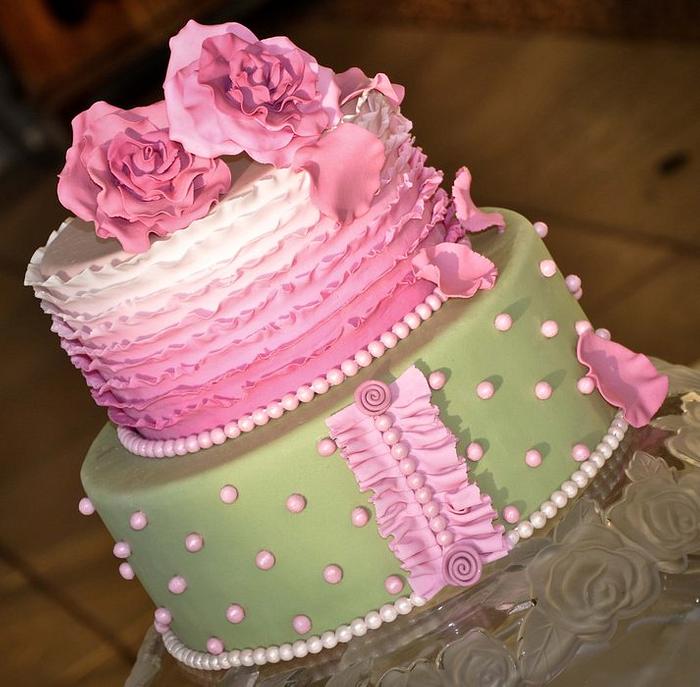
Where is `pink frill decoration`? pink frill decoration is located at coordinates (393, 499).